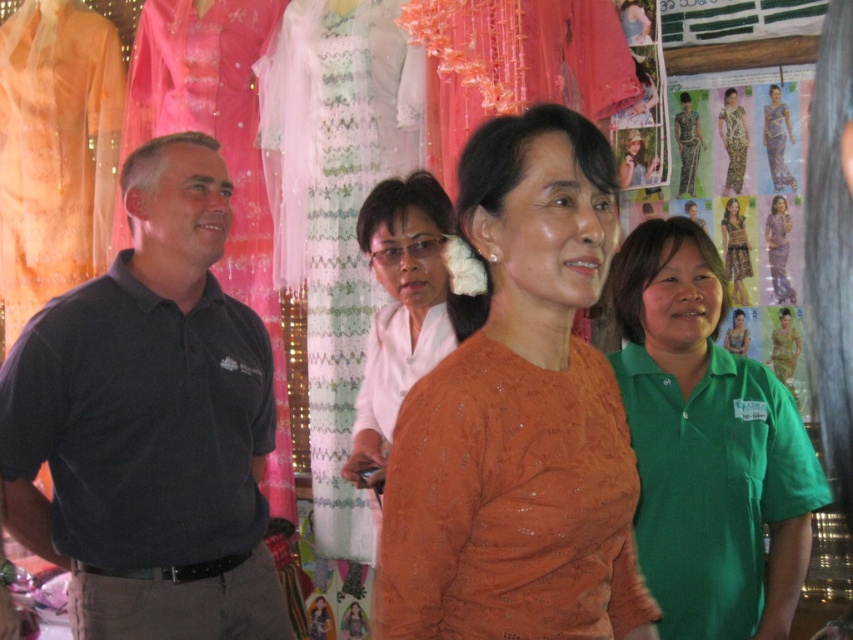
You are a store employee who needs to place a new hanger between the green fabric shirt at center and the matte white shirt at center. The hanger requires 30 inches of space. Is there enough space between them?

The green fabric shirt at center is 28.57 inches away from matte white shirt at center, so there is not enough space to place the hanger between them since it requires 30 inches.

You are a tailor who needs to determine which shirt to place in a standard 12 inch wide display case. Given the green fabric shirt at center and the matte white shirt at center, which one can fit better in the case based on their widths?

The matte white shirt at center has a smaller width compared to the green fabric shirt at center. Since the display case is 12 inches wide, the matte white shirt at center is more likely to fit better within the case.

Looking at this image, you are a store employee who needs to place a new mannequin between the dark blue polo shirt at left and the matte purple dress at upper right. The mannequin requires a minimum of 5 feet of space. Is there enough space between them to accommodate the mannequin?

The distance between the dark blue polo shirt at left and the matte purple dress at upper right is 6.55 feet, which is more than the required 5 feet. Therefore, there is sufficient space to place the mannequin between them.